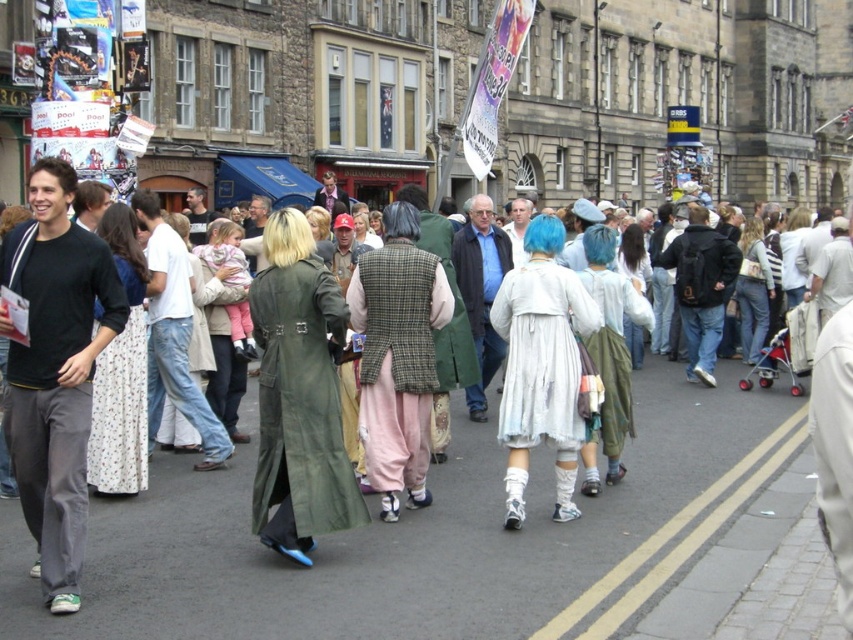
You are a photographer standing on the street and want to take a photo of both the matte green coat at center and the green matte coat at center. Which one will appear larger in the photo?

The matte green coat at center will appear larger in the photo because it is closer to the viewer than the green matte coat at center.

You are standing on the street and want to take a photo of both point (466, 253) and point (509, 236). Which point should you focus on first to ensure both are in focus?

You should focus on point (466, 253) first because it is closer to the camera than point (509, 236), ensuring both are within the depth of field.

You are a photographer trying to capture a shot of the matte green coat at center and the dark gray cotton pants at left. Based on their positions, which one is closer to the camera?

The matte green coat at center is below the dark gray cotton pants at left, meaning it is closer to the camera.